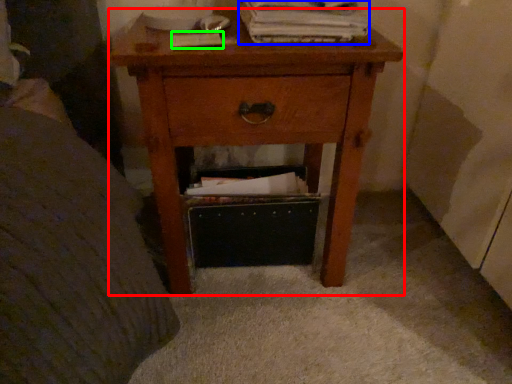
Question: Considering the real-world distances, which object is farthest from nightstand (highlighted by a red box)? paperback book (highlighted by a blue box) or paperback book (highlighted by a green box)?

Choices:
 (A) paperback book
 (B) paperback book

Answer: (B)